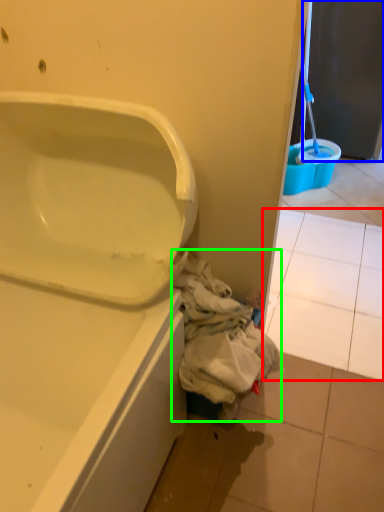
Question: Based on their relative distances, which object is nearer to tile (highlighted by a red box)? Choose from screen door (highlighted by a blue box) and garbage (highlighted by a green box).

Choices:
 (A) screen door
 (B) garbage

Answer: (B)